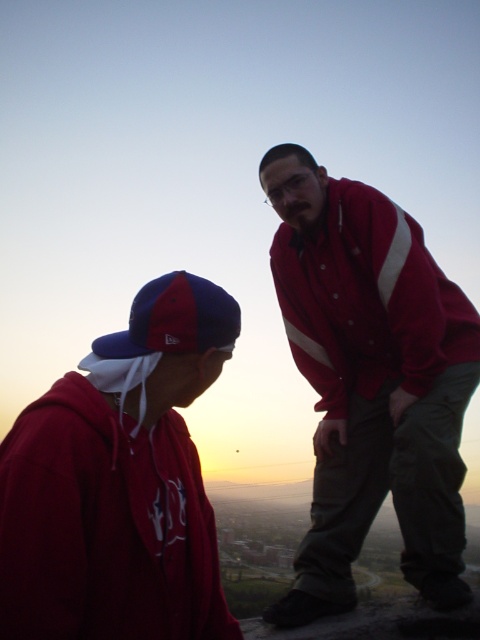
You are standing at the point with coordinates point [187,294] and want to walk to the point with coordinates point [376,433]. Which direction should you move to reach your destination?

To reach point [376,433] from point [187,294], you should move towards the direction where the destination is located behind the starting point, so you need to move backward or in the opposite direction from your current position.

You are a fashion designer analyzing the image. You need to determine which object has a greater horizontal span. Which one is wider between the red matte jacket at right and the blue fabric baseball cap at lower left?

The red matte jacket at right is wider than the blue fabric baseball cap at lower left as its width surpasses the latter.